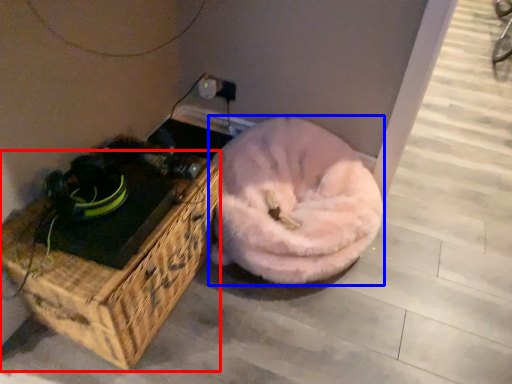
Question: Which of the following is the closest to the observer, furniture (highlighted by a red box) or dog bed (highlighted by a blue box)?

Choices:
 (A) furniture
 (B) dog bed

Answer: (A)